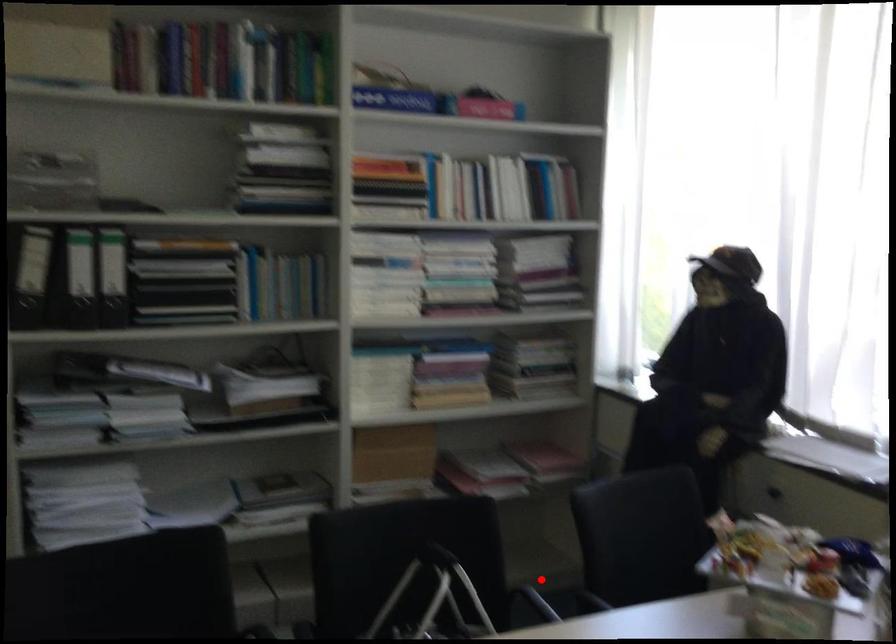
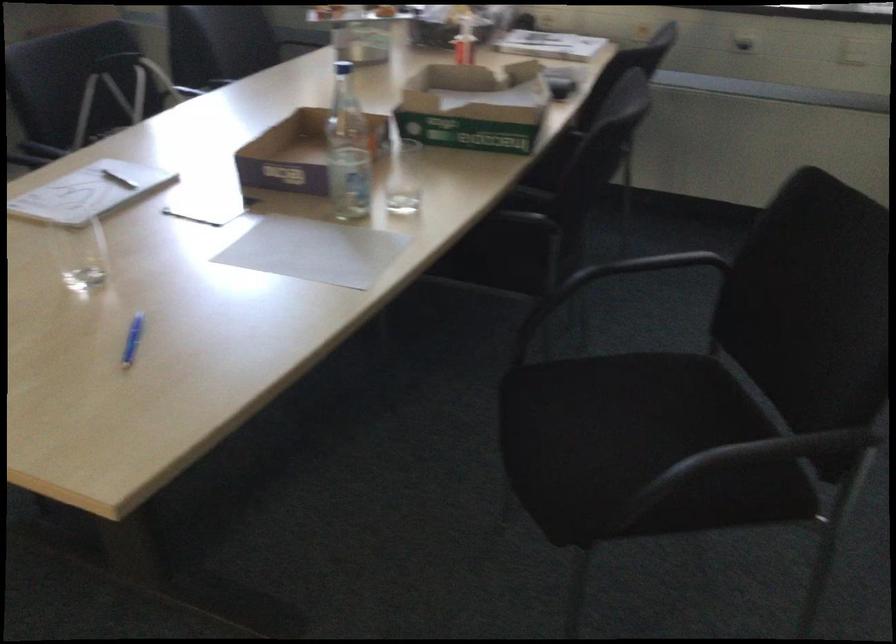
Question: I am providing you with two images of the same scene from different viewpoints. A red point is marked on the first image. At the location where the point appears in image 1, is it still visible in image 2?

Choices:
 (A) Yes
 (B) No

Answer: (B)